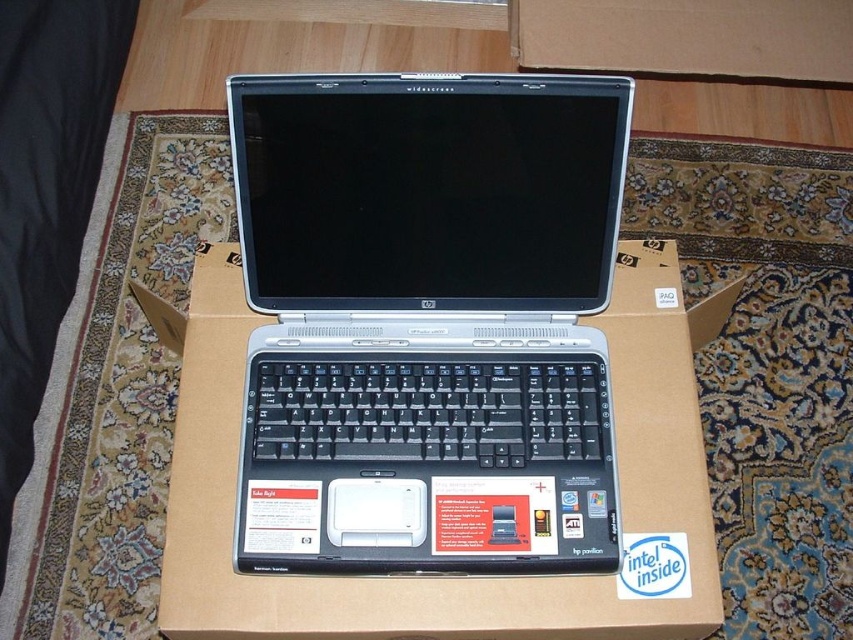
Does cardboard at center appear under black plastic keyboard at center?

Indeed, cardboard at center is positioned under black plastic keyboard at center.

Who is more distant from viewer, (659, 394) or (367, 413)?

Point (659, 394)

Which is in front, point (541, 579) or point (590, 385)?

Positioned in front is point (541, 579).

Image resolution: width=853 pixels, height=640 pixels. I want to click on cardboard at center, so click(444, 577).

Who is higher up, silver/black keyboard at center or cardboard at center?

silver/black keyboard at center

Is point (616, 170) positioned in front of point (286, 589)?

Yes, it is.

You are a GUI agent. You are given a task and a screenshot of the screen. Output one action in this format:
    pyautogui.click(x=<x>, y=<y>)
    Task: Click on the silver/black keyboard at center
    This screenshot has width=853, height=640.
    Given the screenshot: What is the action you would take?
    pyautogui.click(x=427, y=317)

Does silver/black keyboard at center have a larger size compared to black plastic keyboard at center?

Yes, silver/black keyboard at center is bigger than black plastic keyboard at center.

Find the location of a particular element. This screenshot has width=853, height=640. silver/black keyboard at center is located at coordinates (427, 317).